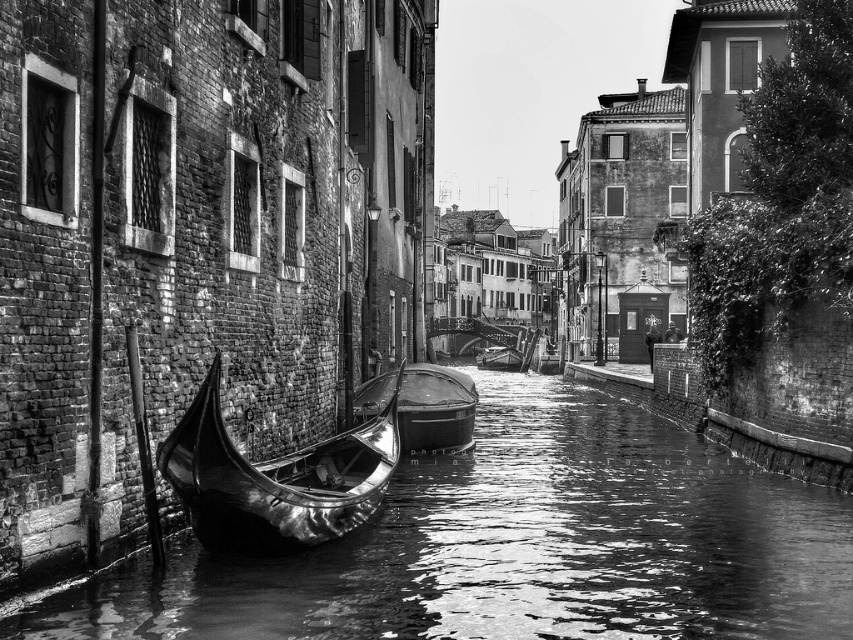
Does shiny polished wood canoe at left come in front of shiny black gondola at center?

That is True.

Can you confirm if shiny polished wood canoe at left is thinner than shiny black gondola at center?

Yes, shiny polished wood canoe at left is thinner than shiny black gondola at center.

Is point (349, 497) closer to camera compared to point (444, 451)?

That is True.

This screenshot has width=853, height=640. Identify the location of shiny polished wood canoe at left. (276, 477).

Does glossy wood canal at center appear under shiny polished wood canoe at left?

Correct, glossy wood canal at center is located below shiny polished wood canoe at left.

Can you confirm if glossy wood canal at center is wider than shiny polished wood canoe at left?

Yes.

Who is more forward, [486,529] or [277,545]?

Point [277,545] is more forward.

Locate an element on the screen. The width and height of the screenshot is (853, 640). glossy wood canal at center is located at coordinates (515, 547).

Which is more to the left, glossy wood canal at center or shiny black gondola at center?

Positioned to the left is shiny black gondola at center.

Who is shorter, glossy wood canal at center or shiny black gondola at center?

shiny black gondola at center

Which is behind, point (590, 433) or point (378, 388)?

The point (590, 433) is more distant.

The image size is (853, 640). I want to click on glossy wood canal at center, so click(515, 547).